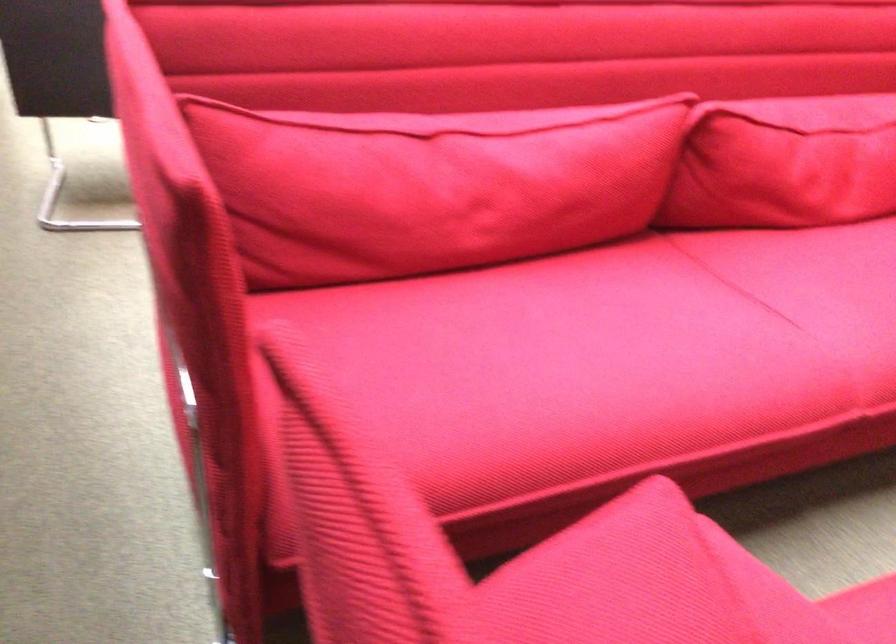
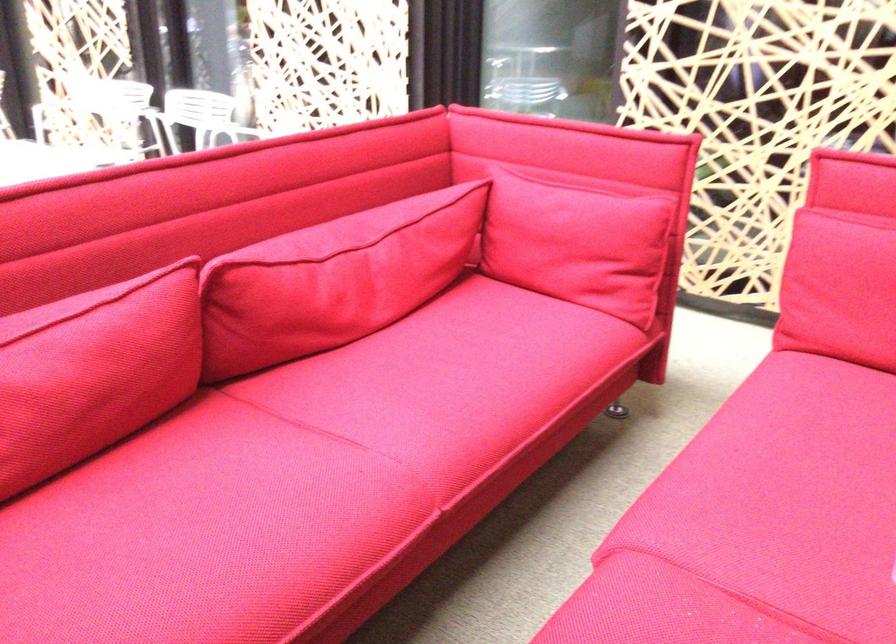
In the second image, find the point that corresponds to the point at 569,167 in the first image.

(93, 371)